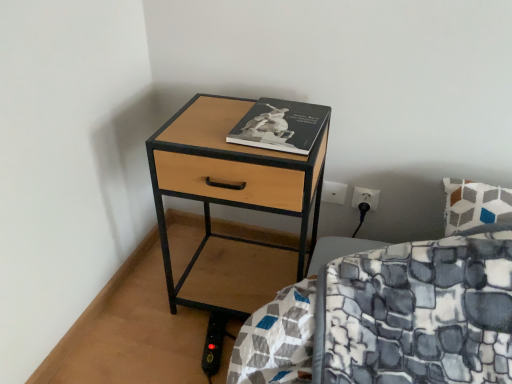
This screenshot has height=384, width=512. What do you see at coordinates (280, 126) in the screenshot? I see `black matte book at center` at bounding box center [280, 126].

You are a GUI agent. You are given a task and a screenshot of the screen. Output one action in this format:
    pyautogui.click(x=<x>, y=<y>)
    Task: Click on the black matte book at center
    
    Given the screenshot: What is the action you would take?
    pyautogui.click(x=280, y=126)

The image size is (512, 384). Describe the element at coordinates (231, 178) in the screenshot. I see `woodenmaterial/texturenightstand at lower left` at that location.

Identify the location of woodenmaterial/texturenightstand at lower left. (231, 178).

This screenshot has width=512, height=384. Find the location of `black matte book at center`. black matte book at center is located at coordinates (280, 126).

Visually, is black matte book at center positioned to the left or to the right of woodenmaterial/texturenightstand at lower left?

black matte book at center is positioned on woodenmaterial/texturenightstand at lower left's right side.

Which is in front, black matte book at center or woodenmaterial/texturenightstand at lower left?

woodenmaterial/texturenightstand at lower left is in front.

Considering the points (323, 121) and (211, 166), which point is behind, point (323, 121) or point (211, 166)?

Positioned behind is point (323, 121).

In the scene shown: From the image's perspective, which is above, black matte book at center or woodenmaterial/texturenightstand at lower left?

From the image's view, black matte book at center is above.

From a real-world perspective, is black matte book at center over woodenmaterial/texturenightstand at lower left?

Yes, from a real-world perspective, black matte book at center is above woodenmaterial/texturenightstand at lower left.

Does black matte book at center have a lesser width compared to woodenmaterial/texturenightstand at lower left?

Indeed, black matte book at center has a lesser width compared to woodenmaterial/texturenightstand at lower left.

Can you confirm if black matte book at center is shorter than woodenmaterial/texturenightstand at lower left?

Correct, black matte book at center is not as tall as woodenmaterial/texturenightstand at lower left.

Is black matte book at center bigger or smaller than woodenmaterial/texturenightstand at lower left?

Clearly, black matte book at center is smaller in size than woodenmaterial/texturenightstand at lower left.

Is black matte book at center inside the boundaries of woodenmaterial/texturenightstand at lower left, or outside?

black matte book at center is spatially situated outside woodenmaterial/texturenightstand at lower left.

Based on the photo, would you consider black matte book at center to be distant from woodenmaterial/texturenightstand at lower left?

No, black matte book at center is in close proximity to woodenmaterial/texturenightstand at lower left.

Is black matte book at center looking in the opposite direction of woodenmaterial/texturenightstand at lower left?

No, black matte book at center is not facing away from woodenmaterial/texturenightstand at lower left.

How many degrees apart are the facing directions of black matte book at center and woodenmaterial/texturenightstand at lower left?

There is a 3.31-degree angle between the facing directions of black matte book at center and woodenmaterial/texturenightstand at lower left.

In order to click on nightstand that appears below the black matte book at center (from the image's perspective) in this screenshot , I will do `click(231, 178)`.

Which is more to the left, woodenmaterial/texturenightstand at lower left or black matte book at center?

Positioned to the left is woodenmaterial/texturenightstand at lower left.

Which object is further away from the camera taking this photo, woodenmaterial/texturenightstand at lower left or black matte book at center?

black matte book at center is further away from the camera.

Which is farther from the camera, (315, 161) or (274, 142)?

The point (315, 161) is farther.

From the image's perspective, is woodenmaterial/texturenightstand at lower left on top of black matte book at center?

No, from the image's perspective, woodenmaterial/texturenightstand at lower left is not above black matte book at center.

From a real-world perspective, is woodenmaterial/texturenightstand at lower left under black matte book at center?

Indeed, from a real-world perspective, woodenmaterial/texturenightstand at lower left is positioned beneath black matte book at center.

Which of these two, woodenmaterial/texturenightstand at lower left or black matte book at center, is thinner?

black matte book at center.

Is woodenmaterial/texturenightstand at lower left shorter than black matte book at center?

Incorrect, the height of woodenmaterial/texturenightstand at lower left does not fall short of that of black matte book at center.

Is woodenmaterial/texturenightstand at lower left bigger than black matte book at center?

Correct, woodenmaterial/texturenightstand at lower left is larger in size than black matte book at center.

Is woodenmaterial/texturenightstand at lower left inside the boundaries of black matte book at center, or outside?

woodenmaterial/texturenightstand at lower left exists outside the volume of black matte book at center.

Is the surface of woodenmaterial/texturenightstand at lower left in direct contact with black matte book at center?

No, woodenmaterial/texturenightstand at lower left is not in contact with black matte book at center.

Is woodenmaterial/texturenightstand at lower left oriented towards black matte book at center?

No, woodenmaterial/texturenightstand at lower left does not turn towards black matte book at center.

What's the angular difference between woodenmaterial/texturenightstand at lower left and black matte book at center's facing directions?

There is a 3.31-degree angle between the facing directions of woodenmaterial/texturenightstand at lower left and black matte book at center.

Image resolution: width=512 pixels, height=384 pixels. I want to click on nightstand below the black matte book at center (from a real-world perspective), so click(x=231, y=178).

The image size is (512, 384). What are the coordinates of `nightstand that appears on the left of black matte book at center` in the screenshot? It's located at (231, 178).

This screenshot has width=512, height=384. I want to click on nightstand that appears in front of the black matte book at center, so click(231, 178).